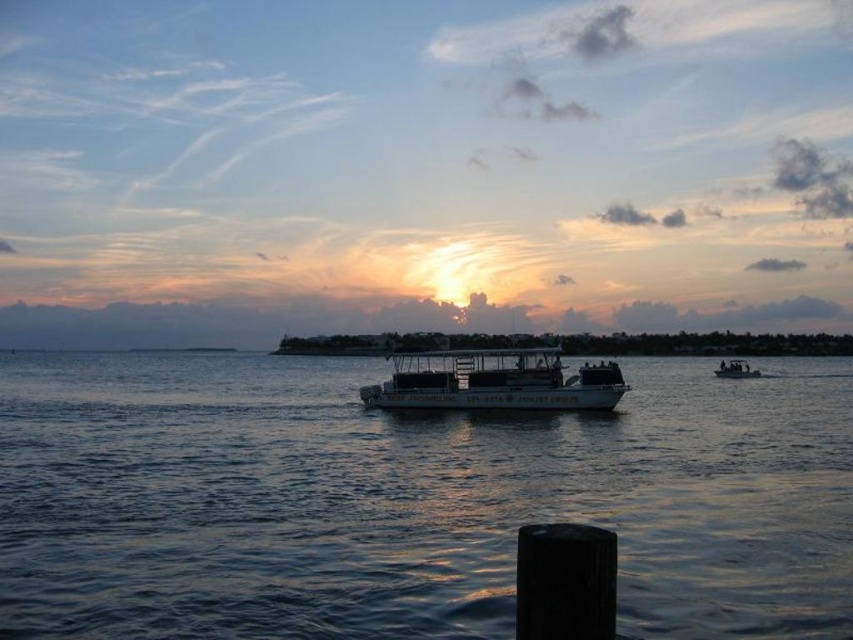
You are standing on the wooden post in the foreground of the sunset scene. Looking towards the center of the water, what color does the point at coordinates (409, 500) represent?

The point at coordinates (409, 500) corresponds to dark blue water at center.

You are an observer standing on the wooden post in the foreground. You notice the dark blue water at center and the white matte boat at center. Which one is wider?

The dark blue water at center is wider than the white matte boat at center.